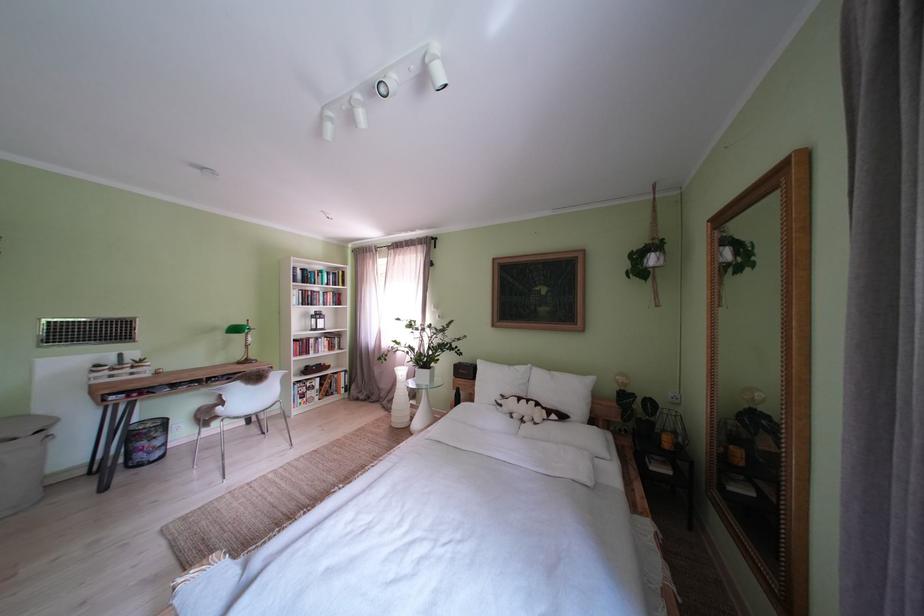
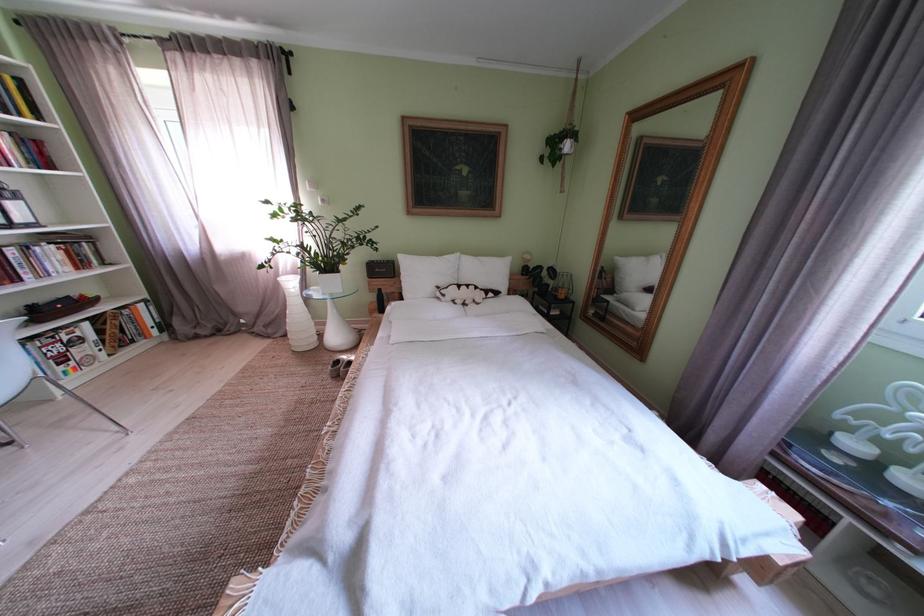
The point at (341, 301) is marked in the first image. Where is the corresponding point in the second image?

(16, 145)